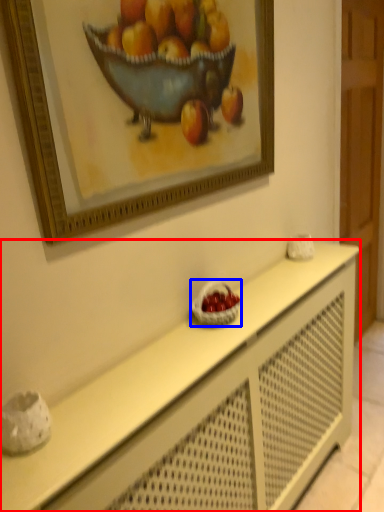
Question: Which object appears closest to the camera in this image, table (highlighted by a red box) or basket (highlighted by a blue box)?

Choices:
 (A) table
 (B) basket

Answer: (A)